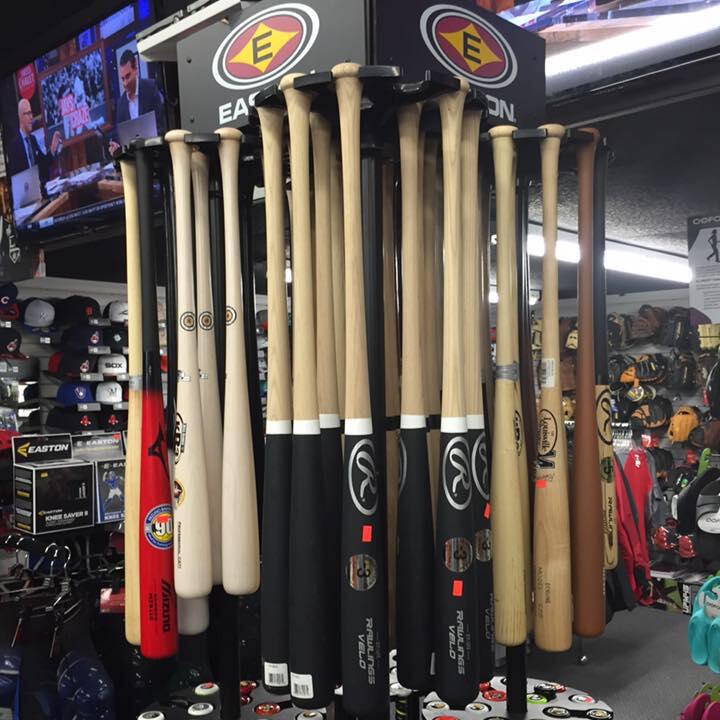
Where is `hangers`? Image resolution: width=720 pixels, height=720 pixels. hangers is located at coordinates (76, 585), (39, 582), (26, 572).